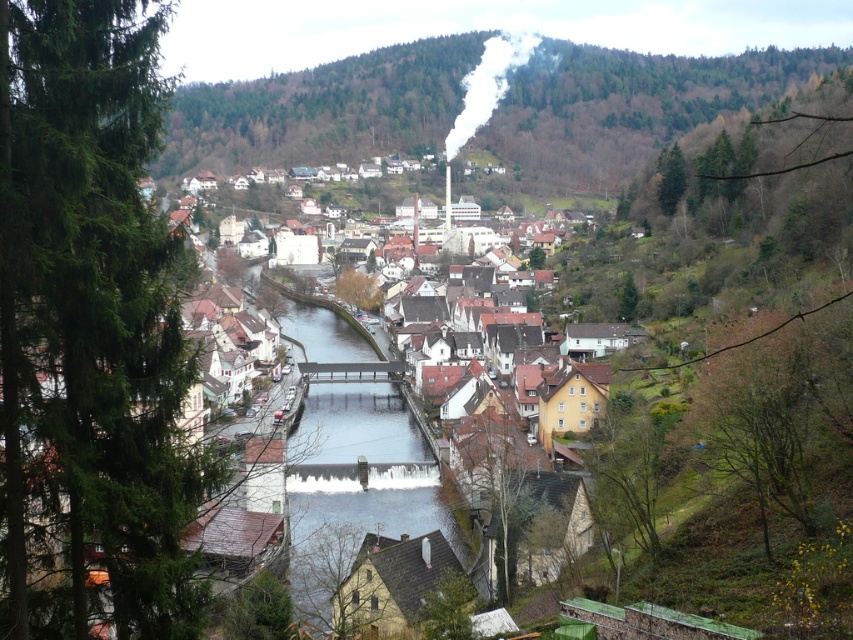
Question: Which is nearer to the white smoke at upper center?

Choices:
 (A) smooth concrete bridge at center
 (B) green forested hillside at upper center

Answer: (B)

Question: Which of the following is the farthest from the observer?

Choices:
 (A) white smoke at upper center
 (B) green forested hillside at upper center
 (C) smooth concrete bridge at center

Answer: (A)

Question: Is green forested hillside at upper center wider than white smoke at upper center?

Choices:
 (A) yes
 (B) no

Answer: (A)

Question: Which object is the farthest from the smooth concrete bridge at center?

Choices:
 (A) green forested hillside at upper center
 (B) white smoke at upper center

Answer: (B)

Question: Does green forested hillside at upper center appear on the left side of white smoke at upper center?

Choices:
 (A) no
 (B) yes

Answer: (B)

Question: Observing the image, what is the correct spatial positioning of smooth concrete bridge at center in reference to white smoke at upper center?

Choices:
 (A) left
 (B) right

Answer: (A)